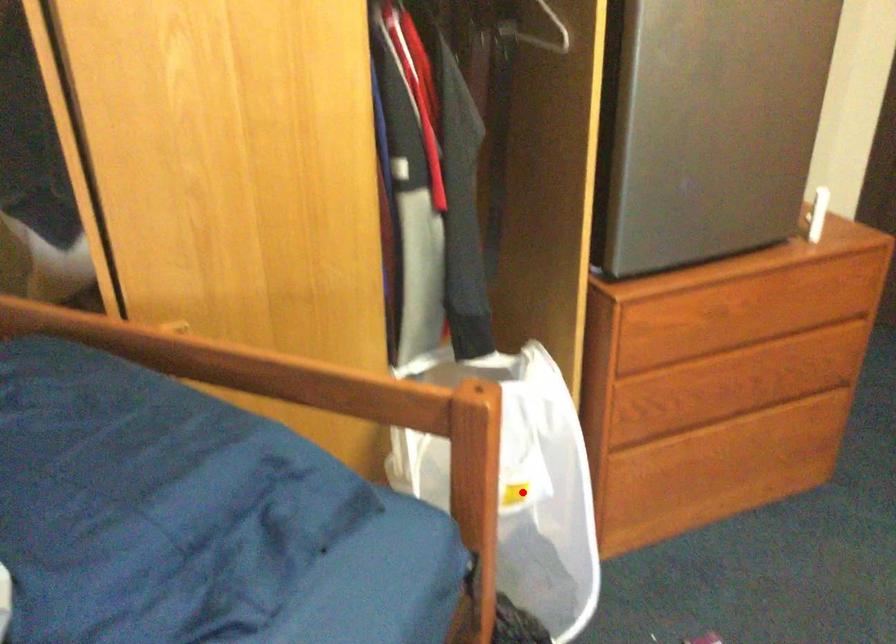
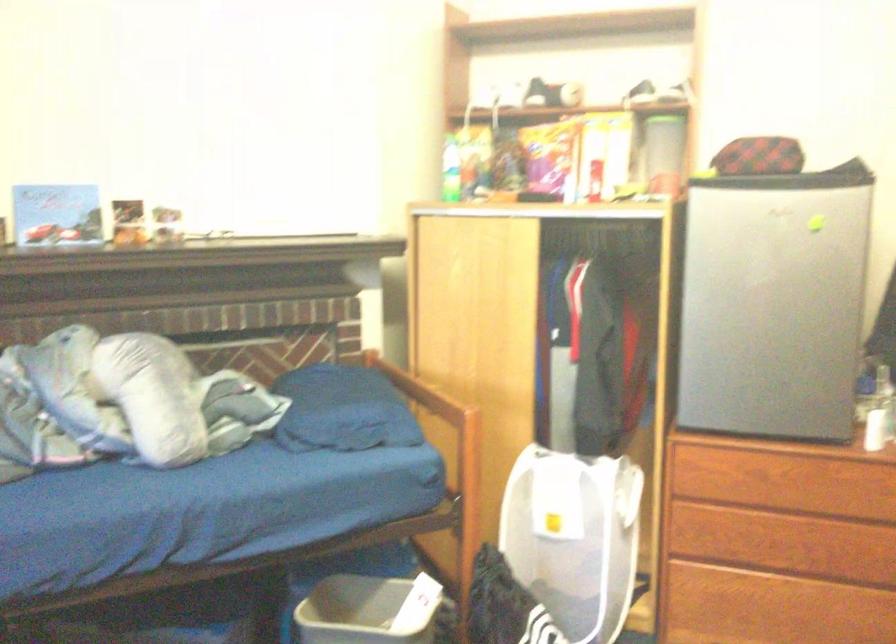
The point at the highlighted location is marked in the first image. Where is the corresponding point in the second image?

(574, 538)